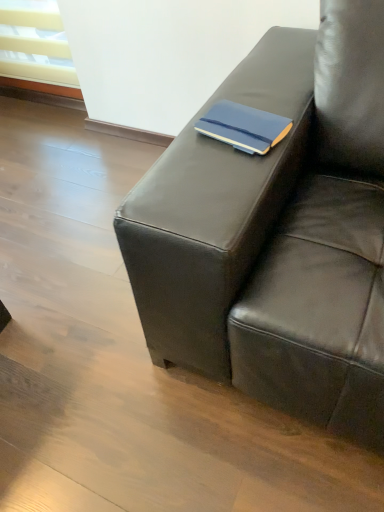
Question: Is matte black couch at center facing away from matte blue notebook at center?

Choices:
 (A) yes
 (B) no

Answer: (B)

Question: Is matte black couch at center taller than matte blue notebook at center?

Choices:
 (A) no
 (B) yes

Answer: (B)

Question: Does matte black couch at center appear on the left side of matte blue notebook at center?

Choices:
 (A) yes
 (B) no

Answer: (B)

Question: Is the position of matte black couch at center less distant than that of matte blue notebook at center?

Choices:
 (A) no
 (B) yes

Answer: (B)

Question: Is matte black couch at center smaller than matte blue notebook at center?

Choices:
 (A) no
 (B) yes

Answer: (A)

Question: From the image's perspective, is matte black couch at center on top of matte blue notebook at center?

Choices:
 (A) no
 (B) yes

Answer: (A)

Question: Is matte blue notebook at center surrounding matte black couch at center?

Choices:
 (A) no
 (B) yes

Answer: (A)

Question: Does matte blue notebook at center have a lesser width compared to matte black couch at center?

Choices:
 (A) no
 (B) yes

Answer: (B)

Question: Does matte blue notebook at center have a greater width compared to matte black couch at center?

Choices:
 (A) yes
 (B) no

Answer: (B)

Question: Does matte blue notebook at center have a larger size compared to matte black couch at center?

Choices:
 (A) yes
 (B) no

Answer: (B)

Question: From a real-world perspective, does matte blue notebook at center sit lower than matte black couch at center?

Choices:
 (A) no
 (B) yes

Answer: (A)

Question: Can you confirm if matte blue notebook at center is taller than matte black couch at center?

Choices:
 (A) yes
 (B) no

Answer: (B)

Question: Choose the correct answer: Is matte black couch at center inside matte blue notebook at center or outside it?

Choices:
 (A) inside
 (B) outside

Answer: (B)